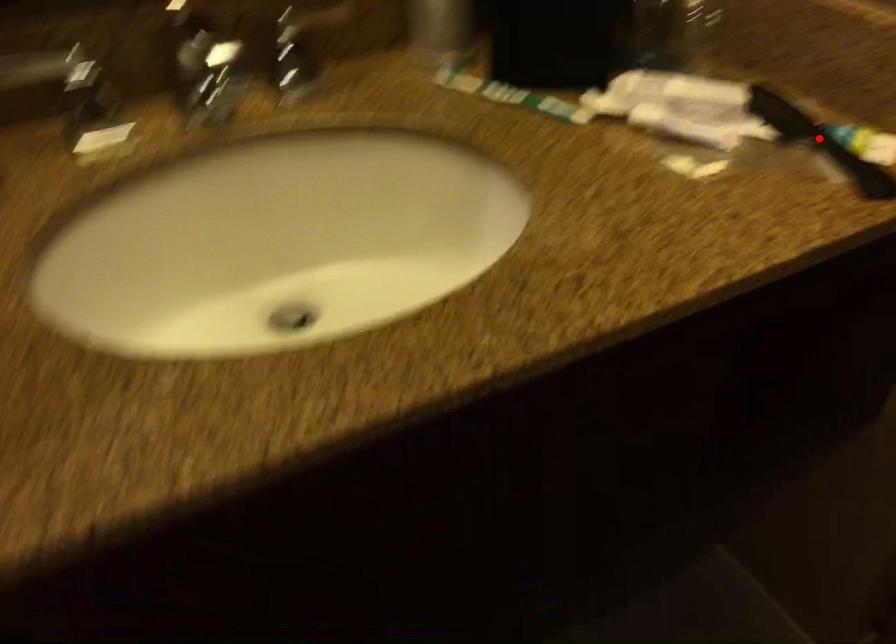
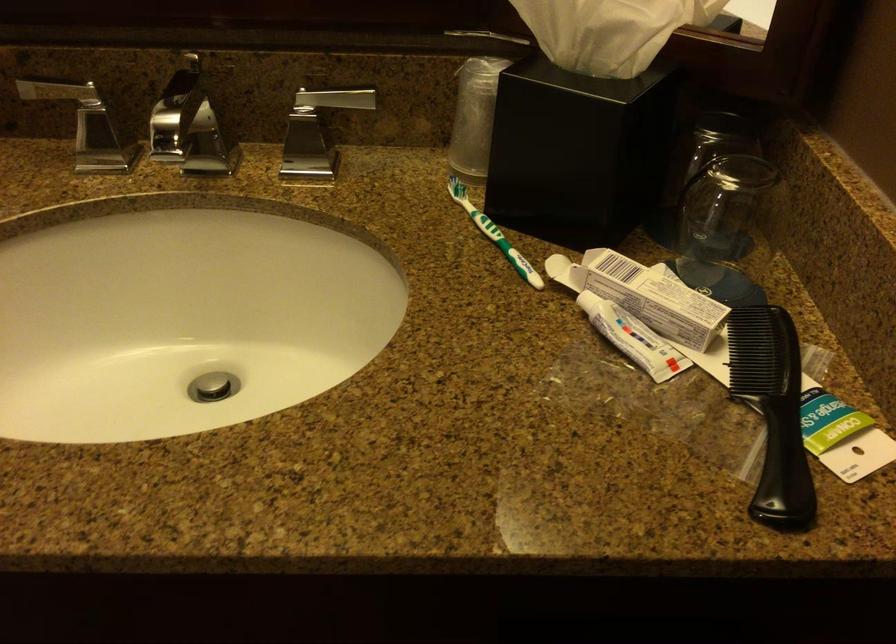
Question: I am providing you with two images of the same scene from different viewpoints. A red point is marked on the first image. Can you still see the location of the red point in image 2?

Choices:
 (A) Yes
 (B) No

Answer: (A)